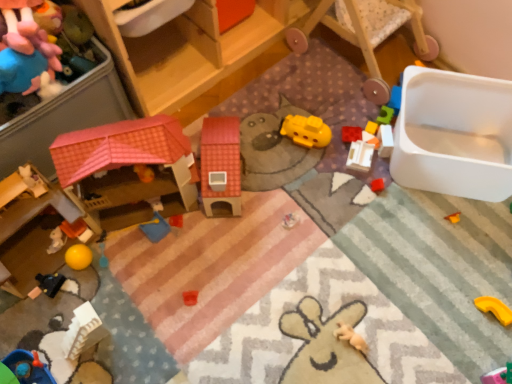
Where is `vacant location behind yellow matte block at upper right, the ninth toy when ordered from left to right`? Image resolution: width=512 pixels, height=384 pixels. vacant location behind yellow matte block at upper right, the ninth toy when ordered from left to right is located at coordinates (351, 96).